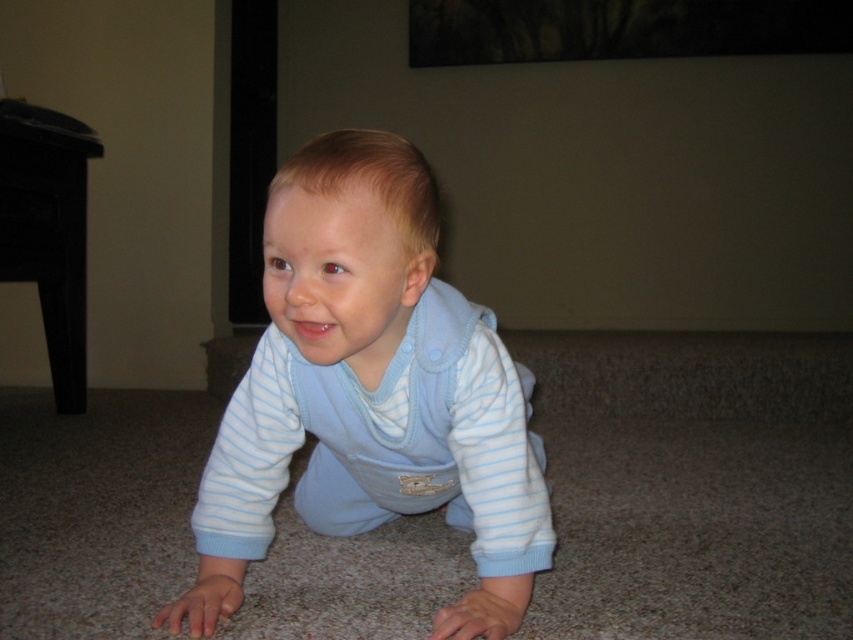
Question: Is light blue soft fabric baby at center above black wood table at left?

Choices:
 (A) yes
 (B) no

Answer: (B)

Question: Can you confirm if light blue soft fabric baby at center is smaller than black wood table at left?

Choices:
 (A) no
 (B) yes

Answer: (A)

Question: Does light blue soft fabric baby at center have a greater width compared to black wood table at left?

Choices:
 (A) no
 (B) yes

Answer: (B)

Question: Which point is farther to the camera?

Choices:
 (A) (61, 410)
 (B) (450, 355)

Answer: (A)

Question: Which point is farther from the camera taking this photo?

Choices:
 (A) (0, 196)
 (B) (251, 483)

Answer: (A)